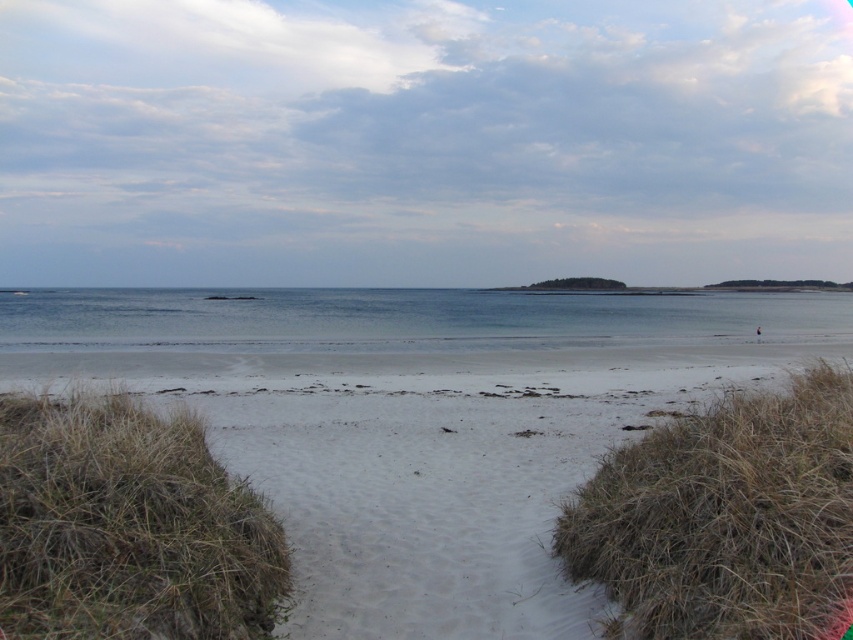
Question: Which point is farther to the camera?

Choices:
 (A) white sand at center
 (B) clear blue water at center

Answer: (B)

Question: Among these points, which one is farthest from the camera?

Choices:
 (A) (368, 604)
 (B) (303, 304)

Answer: (B)

Question: Can you confirm if white sand at center is positioned below clear blue water at center?

Choices:
 (A) no
 (B) yes

Answer: (B)

Question: Which of the following is the farthest from the observer?

Choices:
 (A) clear blue water at center
 (B) white sand at center

Answer: (A)

Question: Does white sand at center come in front of clear blue water at center?

Choices:
 (A) yes
 (B) no

Answer: (A)

Question: Does white sand at center appear on the right side of clear blue water at center?

Choices:
 (A) yes
 (B) no

Answer: (A)